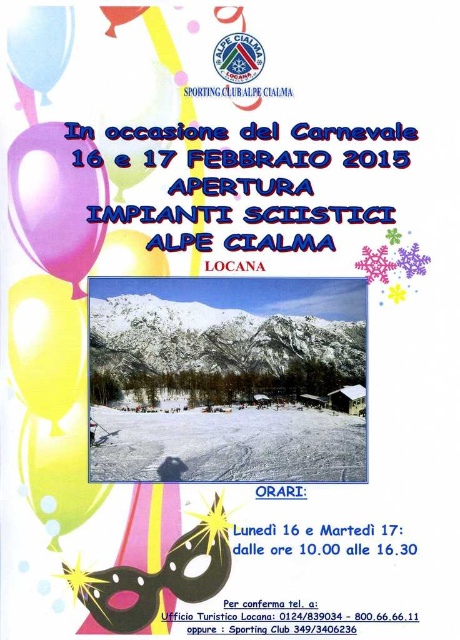
Question: Among these objects, which one is farthest from the camera?

Choices:
 (A) pink glossy balloon at upper left
 (B) snowy white mountain at center
 (C) white snow ski slope at center

Answer: (B)

Question: Considering the real-world distances, which object is farthest from the pink glossy balloon at upper left?

Choices:
 (A) yellow matte balloon at lower left
 (B) white snow ski slope at center

Answer: (B)

Question: Which point is closer to the camera taking this photo?

Choices:
 (A) (12, 38)
 (B) (121, 412)
 (C) (59, 333)
 (D) (92, 504)

Answer: (A)

Question: Is yellow matte balloon at upper left bigger than yellow matte balloon at lower left?

Choices:
 (A) no
 (B) yes

Answer: (A)

Question: Can you confirm if snowy white mountain at center is smaller than matte blue balloon at upper left?

Choices:
 (A) no
 (B) yes

Answer: (A)

Question: Can you confirm if snowy white mountain at center is bigger than yellow matte balloon at upper left?

Choices:
 (A) yes
 (B) no

Answer: (A)